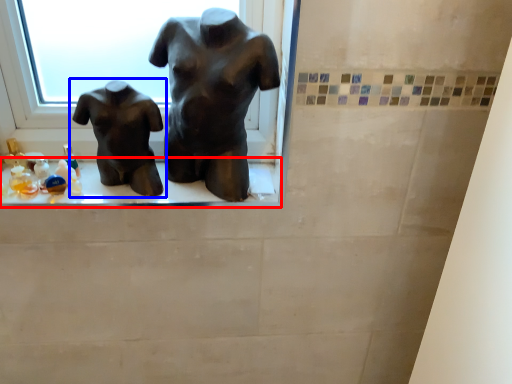
Question: Among these objects, which one is nearest to the camera, window sill (highlighted by a red box) or statue (sculpture) (highlighted by a blue box)?

Choices:
 (A) window sill
 (B) statue (sculpture)

Answer: (B)